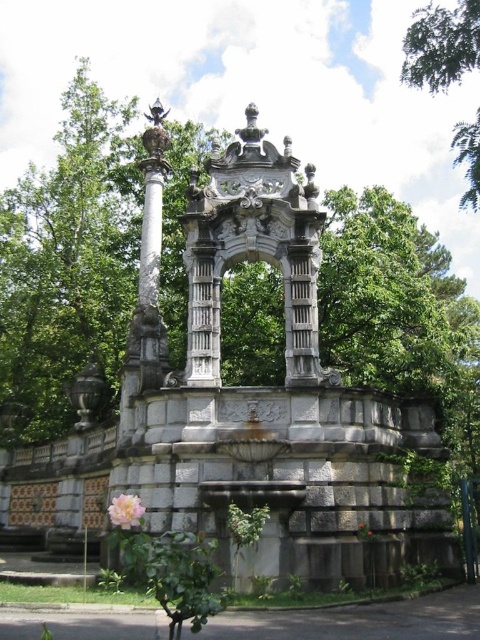
You are standing in the park and want to take a photo of the gray stone fountain at center. If you position yourself directly in front of the fountain, where should you aim your camera to ensure the fountain is centered in the frame?

To center the gray stone fountain at center in your photo, aim your camera at the point with coordinates (x=266, y=396), as that is the 2D location of the fountain.

You are standing in front of the ornate stone fountain in the park. There is a carved stone arch at center. Where exactly is the carved stone arch positioned relative to the fountain?

The carved stone arch at center is located at point 0.389 on the horizontal axis and 0.527 on the vertical axis relative to the fountain.